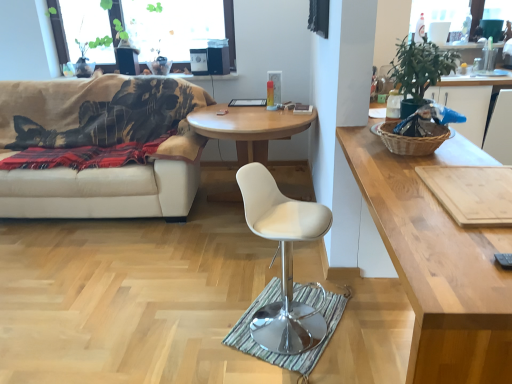
Question: Is wooden cutting board at right situated inside beige fabric couch at left or outside?

Choices:
 (A) outside
 (B) inside

Answer: (A)

Question: Is point (437, 188) closer or farther from the camera than point (94, 79)?

Choices:
 (A) closer
 (B) farther

Answer: (A)

Question: Considering the real-world distances, which object is closest to the textured woven mat at center?

Choices:
 (A) wooden round table at center, which ranks as the second coffee table in front-to-back order
 (B) beige fabric couch at left
 (C) green leafy plant at upper right
 (D) transparent glass window at upper center
 (E) brown woven picnic basket at right

Answer: (E)

Question: Which object is the closest to the green leafy plant at upper right?

Choices:
 (A) white leather stool at center
 (B) light brown wooden cutting board at right, the first coffee table in the right-to-left sequence
 (C) wooden cutting board at right
 (D) brown woven picnic basket at right
 (E) beige fabric couch at left

Answer: (D)